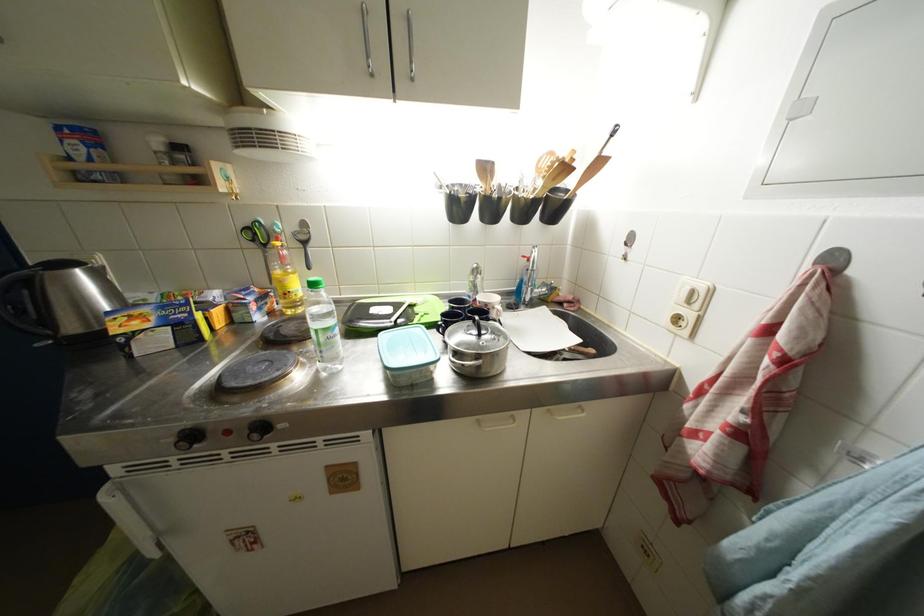
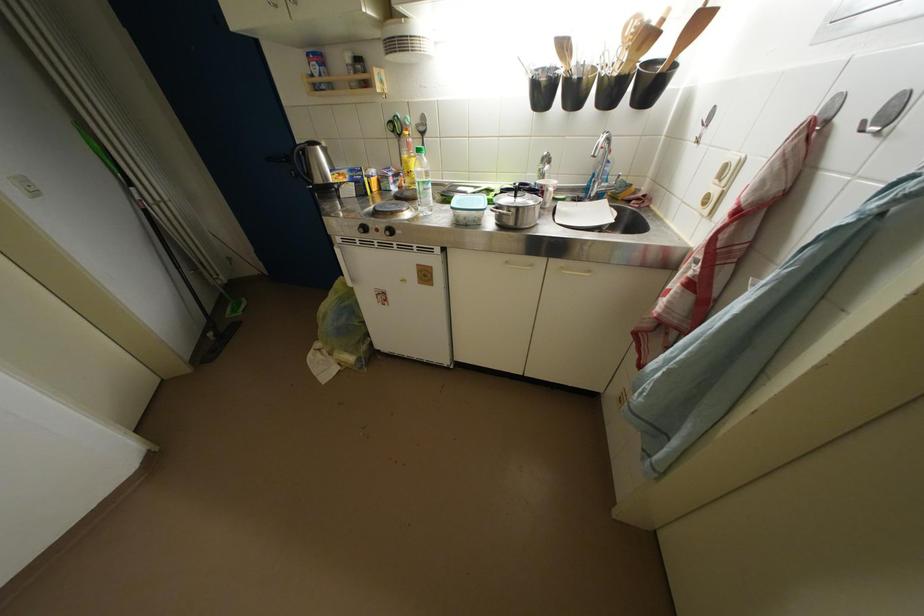
Locate, in the second image, the point that corresponds to point 84,276 in the first image.

(324, 152)